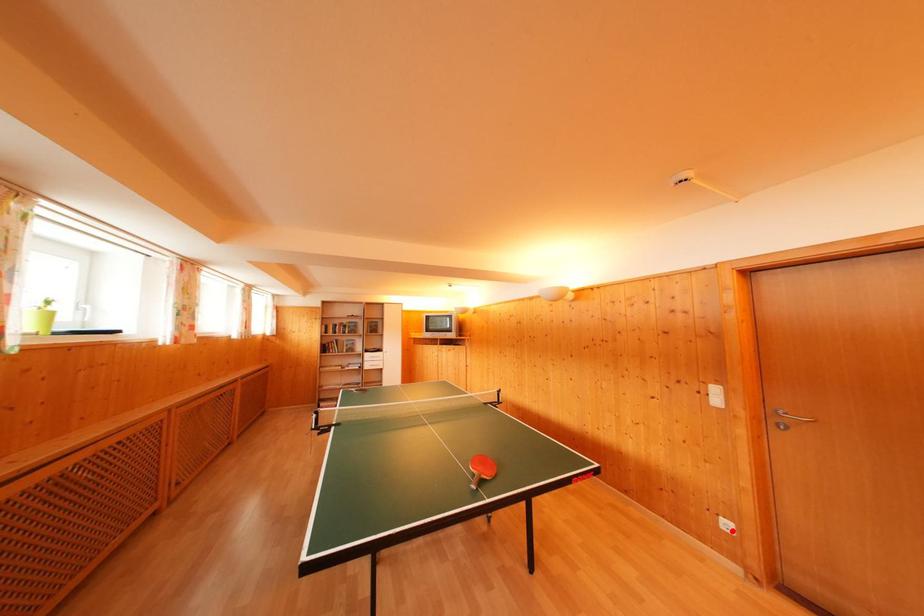
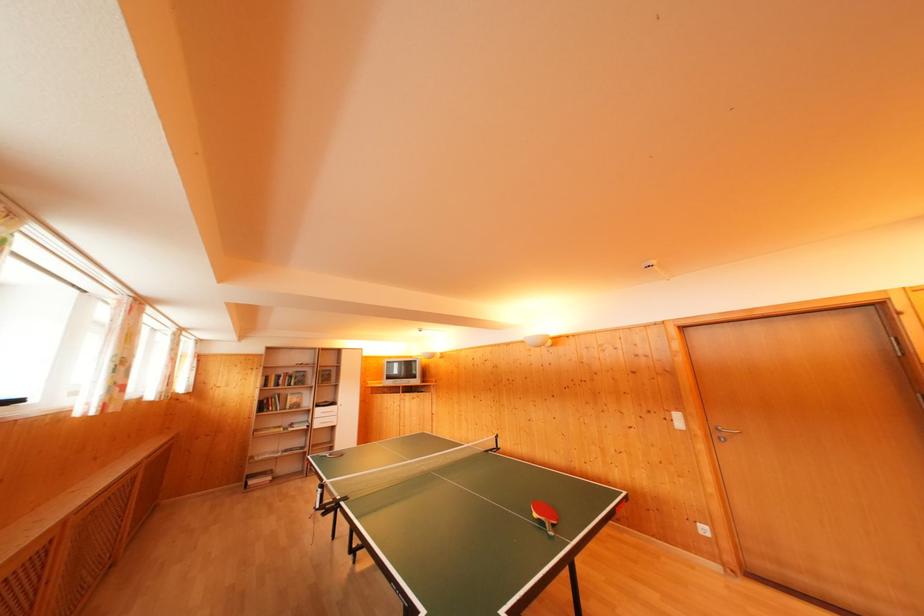
Where in the second image is the point corresponding to the highlighted location from the first image?

(709, 535)